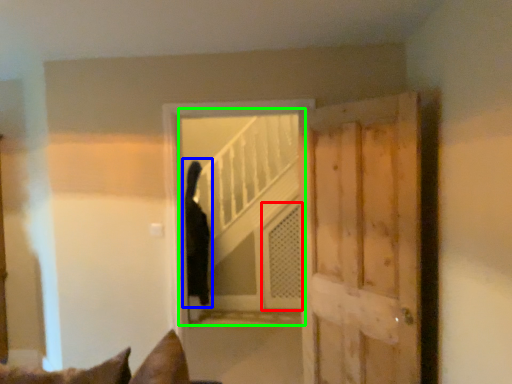
Question: Estimate the real-world distances between objects in this image. Which object is farther from screen door (highlighted by a red box), cat (highlighted by a blue box) or elevator (highlighted by a green box)?

Choices:
 (A) cat
 (B) elevator

Answer: (A)